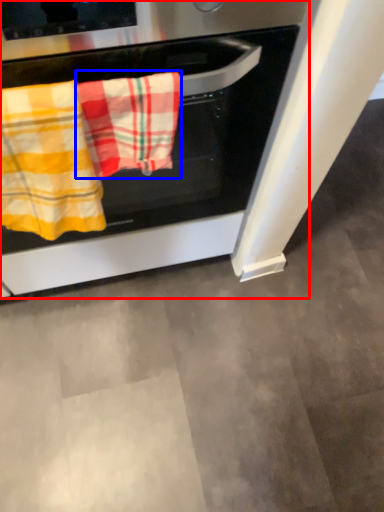
Question: Which object is further to the camera taking this photo, oven (highlighted by a red box) or beach towel (highlighted by a blue box)?

Choices:
 (A) oven
 (B) beach towel

Answer: (B)